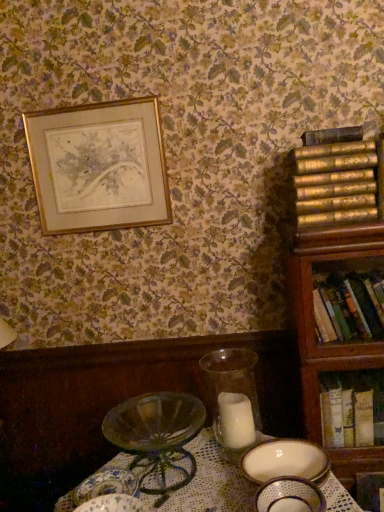
Describe the element at coordinates (337, 178) in the screenshot. I see `gold textured books at right, the 3th book ordered from the bottom` at that location.

Image resolution: width=384 pixels, height=512 pixels. I want to click on gold textured books at right, which appears as the 1th book when viewed from the top, so click(337, 178).

The image size is (384, 512). Find the location of `wooden bookcase at right`. wooden bookcase at right is located at coordinates (339, 295).

This screenshot has width=384, height=512. I want to click on porcelain plate at lower center, positioned as the 1th tableware in back-to-front order, so click(x=106, y=485).

Is hardcover book at right, the 2th book positioned from the bottom, at the right side of translucent glass candle at center?

Yes, hardcover book at right, the 2th book positioned from the bottom, is to the right of translucent glass candle at center.

Considering the relative sizes of hardcover book at right, the 2th book positioned from the bottom, and translucent glass candle at center in the image provided, is hardcover book at right, the 2th book positioned from the bottom, smaller than translucent glass candle at center?

Incorrect, hardcover book at right, the 2th book positioned from the bottom, is not smaller in size than translucent glass candle at center.

Can we say hardcover book at right, the 2th book positioned from the bottom, lies outside translucent glass candle at center?

Yes, hardcover book at right, the 2th book positioned from the bottom, is not within translucent glass candle at center.

Is the surface of hardcover book at right, arranged as the 2th book when viewed from the top, in direct contact with translucent glass candle at center?

hardcover book at right, arranged as the 2th book when viewed from the top, and translucent glass candle at center are not in contact.

From the image's perspective, which object appears higher, white paper book at right, the 3th book viewed from the top, or hardcover book at right, the 2th book positioned from the bottom?

hardcover book at right, the 2th book positioned from the bottom, appears higher in the image.

Is white paper book at right, which is the first book from bottom to top, oriented away from hardcover book at right, the 2th book positioned from the bottom?

No, hardcover book at right, the 2th book positioned from the bottom, is not at the back of white paper book at right, which is the first book from bottom to top.

Locate an element on the screen. This screenshot has height=512, width=384. the 1st book directly above the white paper book at right, which is the first book from bottom to top (from a real-world perspective) is located at coordinates (349, 307).

Can you confirm if white paper book at right, which is the first book from bottom to top, is positioned to the right of hardcover book at right, arranged as the 2th book when viewed from the top?

Yes.

Is translucent glass candle at center aimed at white paper book at right, which is the first book from bottom to top?

No, translucent glass candle at center is not facing towards white paper book at right, which is the first book from bottom to top.

What's the angular difference between translucent glass candle at center and white paper book at right, the 3th book viewed from the top,'s facing directions?

2.39 degrees.

Based on the photo, are translucent glass candle at center and white paper book at right, which is the first book from bottom to top, beside each other?

translucent glass candle at center and white paper book at right, which is the first book from bottom to top, are not in contact.

Considering their positions, is translucent glass candle at center located in front of or behind white paper book at right, the 3th book viewed from the top?

In the image, translucent glass candle at center appears in front of white paper book at right, the 3th book viewed from the top.

Is porcelain plate at lower center, which is the second tableware in right-to-left order, in front of wooden bookcase at right?

That is True.

Considering the relative sizes of porcelain plate at lower center, positioned as the 1th tableware in back-to-front order, and wooden bookcase at right in the image provided, is porcelain plate at lower center, positioned as the 1th tableware in back-to-front order, wider than wooden bookcase at right?

Incorrect, the width of porcelain plate at lower center, positioned as the 1th tableware in back-to-front order, does not surpass that of wooden bookcase at right.

Based on the photo, from the image's perspective, who appears lower, porcelain plate at lower center, which is the 2th tableware from front to back, or wooden bookcase at right?

porcelain plate at lower center, which is the 2th tableware from front to back, from the image's perspective.

From a real-world perspective, is porcelain plate at lower center, which is the 2th tableware from front to back, physically above wooden bookcase at right?

No.

Locate an element on the screen. This screenshot has height=512, width=384. book that is the 2nd object to the right of the translucent glass candle at center, starting at the anchor is located at coordinates (349, 307).

Between translucent glass candle at center and hardcover book at right, arranged as the 2th book when viewed from the top, which one has less height?

Standing shorter between the two is hardcover book at right, arranged as the 2th book when viewed from the top.

Can you confirm if translucent glass candle at center is smaller than hardcover book at right, arranged as the 2th book when viewed from the top?

Yes, translucent glass candle at center is smaller than hardcover book at right, arranged as the 2th book when viewed from the top.

Could you tell me if translucent glass candle at center is turned towards hardcover book at right, the 2th book positioned from the bottom?

No, translucent glass candle at center does not turn towards hardcover book at right, the 2th book positioned from the bottom.

Is point (323, 380) more distant than point (360, 186)?

Yes, it is behind point (360, 186).

How far apart are white paper book at right, the 3th book viewed from the top, and gold textured books at right, the 3th book ordered from the bottom?

The distance of white paper book at right, the 3th book viewed from the top, from gold textured books at right, the 3th book ordered from the bottom, is 26.24 inches.

Is white paper book at right, the 3th book viewed from the top, facing away from gold textured books at right, which appears as the 1th book when viewed from the top?

No, white paper book at right, the 3th book viewed from the top, is not facing the opposite direction of gold textured books at right, which appears as the 1th book when viewed from the top.

From the image's perspective, does white paper book at right, the 3th book viewed from the top, appear lower than gold textured books at right, the 3th book ordered from the bottom?

Correct, white paper book at right, the 3th book viewed from the top, appears lower than gold textured books at right, the 3th book ordered from the bottom, in the image.

Identify the location of tableware above the porcelain plate at lower center, which is the second tableware in right-to-left order (from the image's perspective). The image size is (384, 512). (290, 495).

Can you confirm if porcelain bowl at lower center, acting as the second tableware starting from the back, is wider than porcelain plate at lower center, positioned as the 1th tableware in back-to-front order?

No.

Does point (312, 505) come farther from viewer compared to point (88, 497)?

No, it is not.

Image resolution: width=384 pixels, height=512 pixels. Find the location of `the 3rd book behind when counting from the translucent glass candle at center`. the 3rd book behind when counting from the translucent glass candle at center is located at coordinates (349, 307).

There is a white paper book at right, which is the first book from bottom to top. Where is `the 1st book above it (from a real-world perspective)`? The height and width of the screenshot is (512, 384). the 1st book above it (from a real-world perspective) is located at coordinates point(349,307).

Estimate the real-world distances between objects in this image. Which object is further from gold textured books at right, which appears as the 1th book when viewed from the top, translucent glass candle at center or wooden bookcase at right?

translucent glass candle at center lies further to gold textured books at right, which appears as the 1th book when viewed from the top, than the other object.

Looking at the image, which one is located further to porcelain plate at lower center, which ranks as the first tableware in left-to-right order, white paper book at right, the 3th book viewed from the top, or wooden bookcase at right?

The object further to porcelain plate at lower center, which ranks as the first tableware in left-to-right order, is wooden bookcase at right.

Estimate the real-world distances between objects in this image. Which object is further from porcelain bowl at lower center, which is the second tableware from left to right, translucent glass candle at center or gold textured books at right, which appears as the 1th book when viewed from the top?

Among the two, gold textured books at right, which appears as the 1th book when viewed from the top, is located further to porcelain bowl at lower center, which is the second tableware from left to right.

Considering their positions, is gold textured books at right, the 3th book ordered from the bottom, positioned further to translucent glass candle at center than porcelain plate at lower center, which ranks as the first tableware in left-to-right order?

gold textured books at right, the 3th book ordered from the bottom.

Consider the image. From the image, which object appears to be nearer to hardcover book at right, the 2th book positioned from the bottom, translucent glass candle at center or porcelain bowl at lower center, acting as the second tableware starting from the back?

The object closer to hardcover book at right, the 2th book positioned from the bottom, is translucent glass candle at center.

Which object lies further to the anchor point translucent glass candle at center, wooden bookcase at right or white paper book at right, the 3th book viewed from the top?

wooden bookcase at right.

Looking at the image, which one is located further to wooden bookcase at right, hardcover book at right, the 2th book positioned from the bottom, or translucent glass candle at center?

Based on the image, translucent glass candle at center appears to be further to wooden bookcase at right.

From the image, which object appears to be nearer to wooden bookcase at right, porcelain plate at lower center, which is the second tableware in right-to-left order, or white paper book at right, the 3th book viewed from the top?

white paper book at right, the 3th book viewed from the top, is closer to wooden bookcase at right.

You are a GUI agent. You are given a task and a screenshot of the screen. Output one action in this format:
    pyautogui.click(x=<x>, y=<y>)
    Task: Click on the tableware between porcelain plate at lower center, which is the 2th tableware from front to back, and wooden bookcase at right from left to right
    The image size is (384, 512).
    Given the screenshot: What is the action you would take?
    pyautogui.click(x=290, y=495)

Where is `bookcase between hardcover book at right, the 2th book positioned from the bottom, and white paper book at right, the 3th book viewed from the top, in the vertical direction`? The width and height of the screenshot is (384, 512). bookcase between hardcover book at right, the 2th book positioned from the bottom, and white paper book at right, the 3th book viewed from the top, in the vertical direction is located at coordinates (339, 295).

This screenshot has height=512, width=384. In order to click on bookcase between translucent glass candle at center and white paper book at right, the 3th book viewed from the top, from left to right in this screenshot , I will do `click(339, 295)`.

Image resolution: width=384 pixels, height=512 pixels. Find the location of `candle holder located between porcelain plate at lower center, which is the 2th tableware from front to back, and white paper book at right, the 3th book viewed from the top, in the left-right direction`. candle holder located between porcelain plate at lower center, which is the 2th tableware from front to back, and white paper book at right, the 3th book viewed from the top, in the left-right direction is located at coordinates (233, 398).